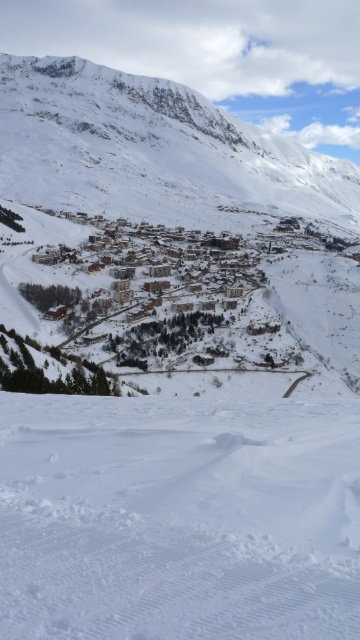
Based on the photo, between white powdery snow at lower center and white snow-covered mountain at center, which one has more height?

Standing taller between the two is white snow-covered mountain at center.

Between point (178, 429) and point (87, 129), which one is positioned behind?

The point (87, 129) is more distant.

At what (x,y) coordinates should I click in order to perform the action: click on white powdery snow at lower center. Please return your answer as a coordinate pair (x, y). Looking at the image, I should click on (177, 518).